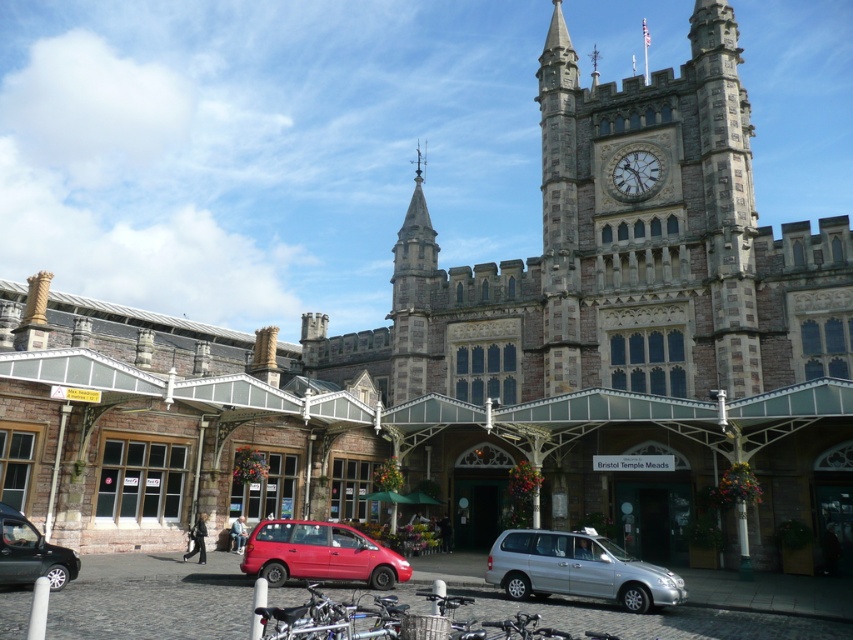
Who is positioned more to the right, silver metallic van at center or matte black car at lower left?

Positioned to the right is silver metallic van at center.

Who is positioned more to the left, silver metallic van at center or matte black car at lower left?

matte black car at lower left is more to the left.

This screenshot has width=853, height=640. I want to click on silver metallic van at center, so click(578, 570).

Which is behind, point (265, 566) or point (38, 572)?

The point (265, 566) is more distant.

Can you confirm if matte red minivan at center is thinner than matte black car at lower left?

No.

Is point (322, 554) more distant than point (4, 536)?

Yes, it is.

This screenshot has width=853, height=640. I want to click on matte red minivan at center, so click(318, 554).

Between matte black car at lower left and stone clock at upper right, which one has less height?

stone clock at upper right is shorter.

Can you confirm if matte black car at lower left is bigger than stone clock at upper right?

Correct, matte black car at lower left is larger in size than stone clock at upper right.

Who is more forward, [19,524] or [616,176]?

Point [19,524]

Where is `matte black car at lower left`? The image size is (853, 640). matte black car at lower left is located at coordinates (32, 554).